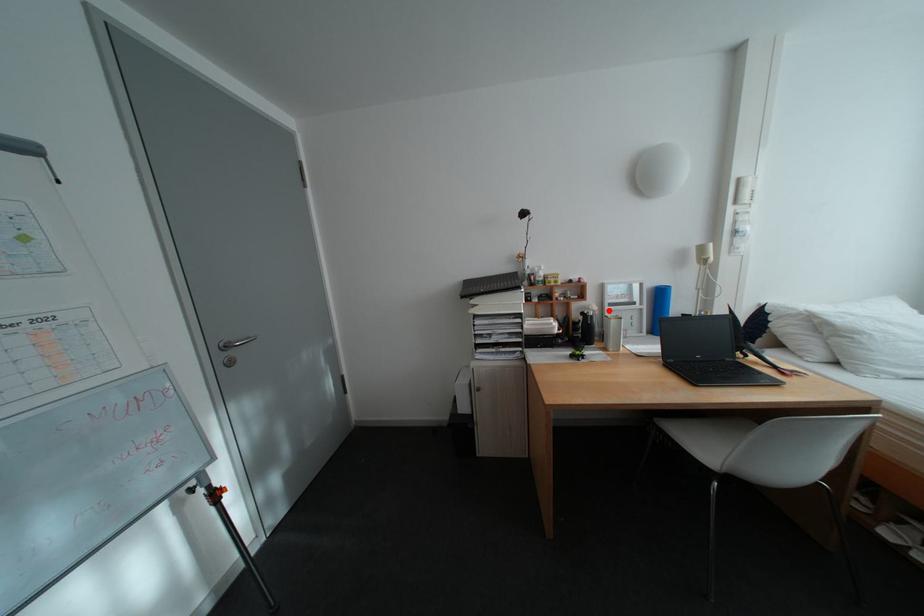
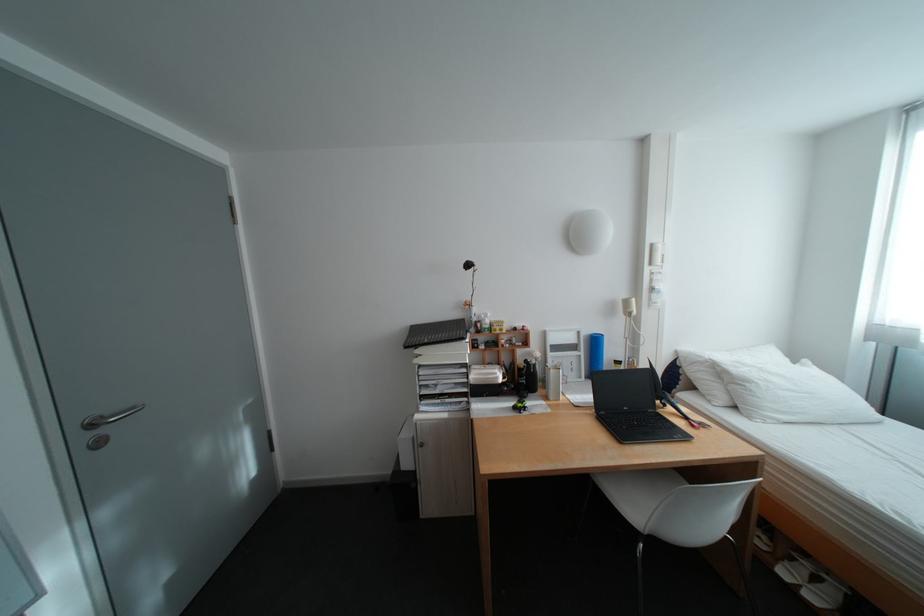
Find the pixel in the second image that matches the highlighted location in the first image.

(552, 358)